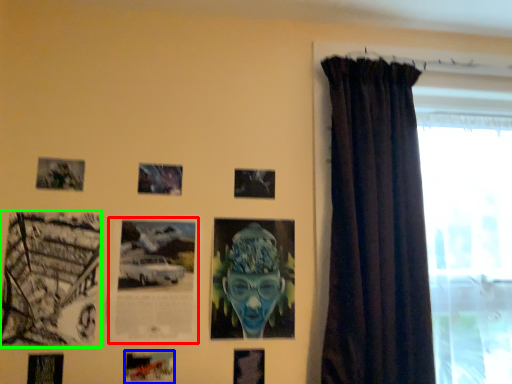
Question: Which is farther away from picture frame (highlighted by a red box)? picture frame (highlighted by a blue box) or picture frame (highlighted by a green box)?

Choices:
 (A) picture frame
 (B) picture frame

Answer: (A)